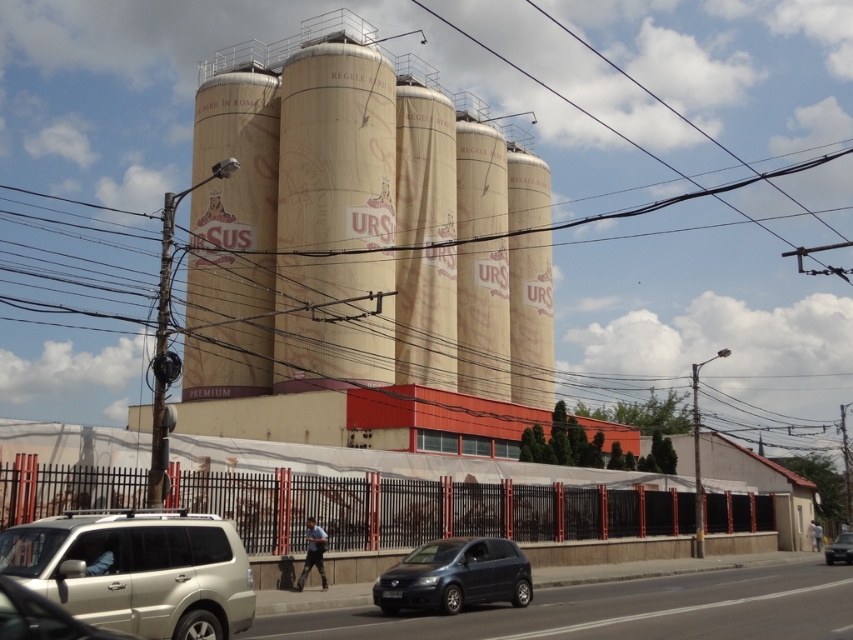
Question: Which point is closer to the camera?

Choices:
 (A) (383, 596)
 (B) (6, 620)

Answer: (B)

Question: Does gold metallic suv at lower left have a larger size compared to matte black car at lower right?

Choices:
 (A) yes
 (B) no

Answer: (B)

Question: In this image, where is metallic silver suv at lower left located relative to matte black car at lower right?

Choices:
 (A) left
 (B) right

Answer: (A)

Question: Among these objects, which one is nearest to the camera?

Choices:
 (A) matte black car at lower right
 (B) metallic silver suv at lower left
 (C) gold metallic suv at lower left
 (D) matte black car at lower center

Answer: (B)

Question: Which point is farther to the camera?

Choices:
 (A) metallic silver suv at lower left
 (B) matte black car at lower center
 (C) gold metallic suv at lower left
 (D) matte black car at lower right

Answer: (D)

Question: Considering the relative positions of gold metallic suv at lower left and matte black car at lower center in the image provided, where is gold metallic suv at lower left located with respect to matte black car at lower center?

Choices:
 (A) above
 (B) below

Answer: (A)